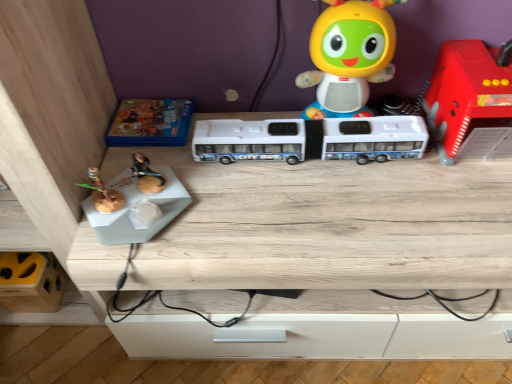
Locate an element on the screen. Image resolution: width=512 pixels, height=384 pixels. vacant space situated above wooden table at center (from a real-world perspective) is located at coordinates (330, 190).